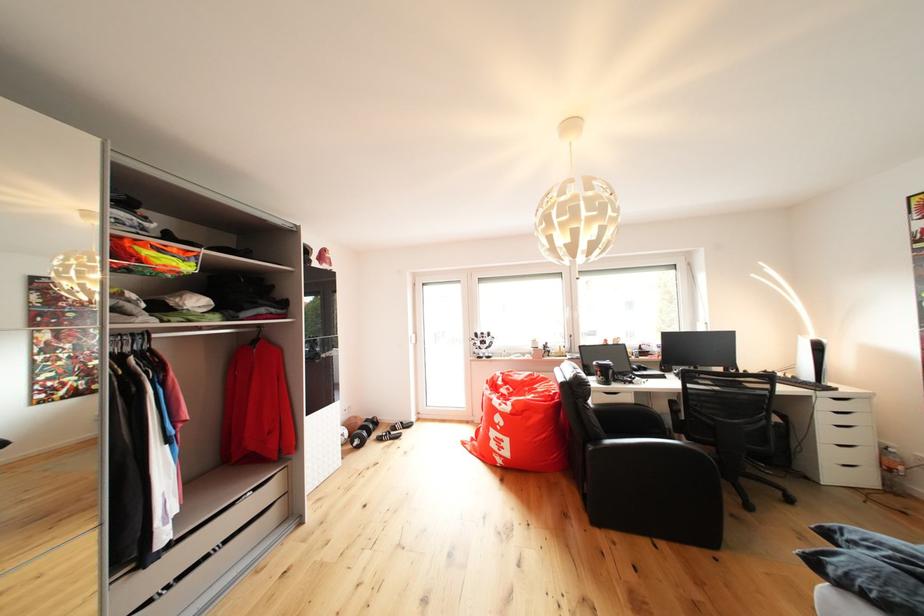
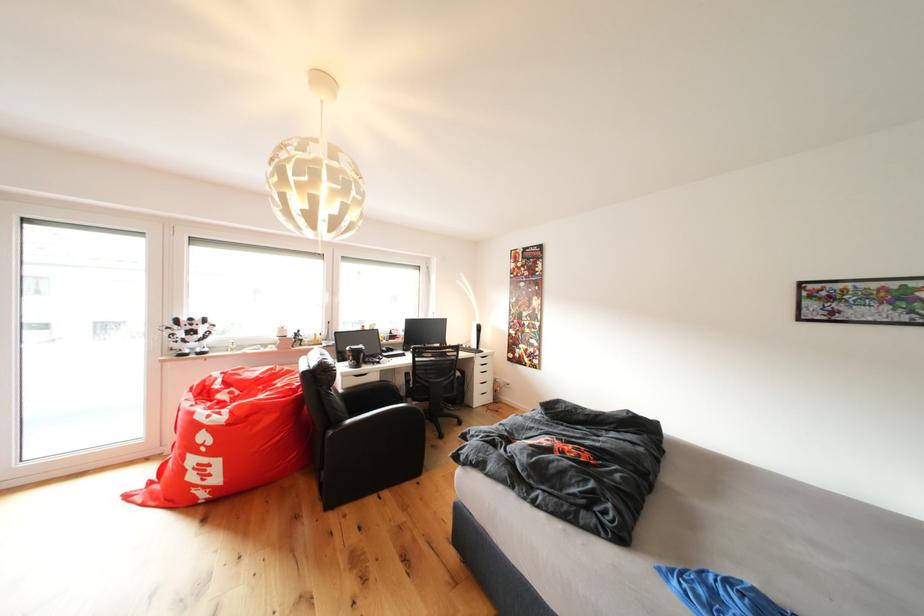
The point at [492,339] is marked in the first image. Where is the corresponding point in the second image?

(200, 323)